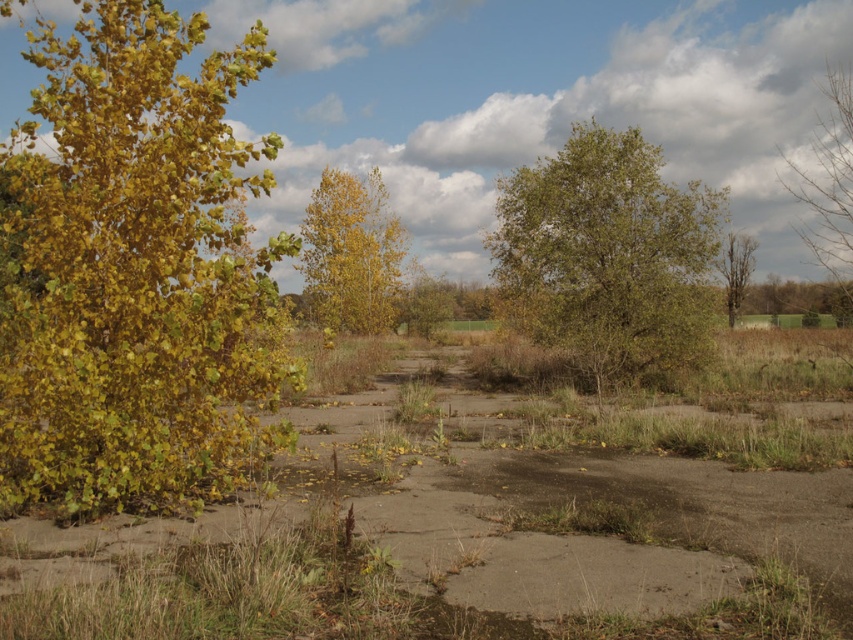
You are standing at the center of the concrete path in the natural landscape scene. There is a point marked at coordinates point (210, 164). Can you determine if this point is within your immediate vicinity, or is it further away?

The distance of point (210, 164) from viewer is 7.55 meters, so it is further away from your current position at the center of the concrete path.